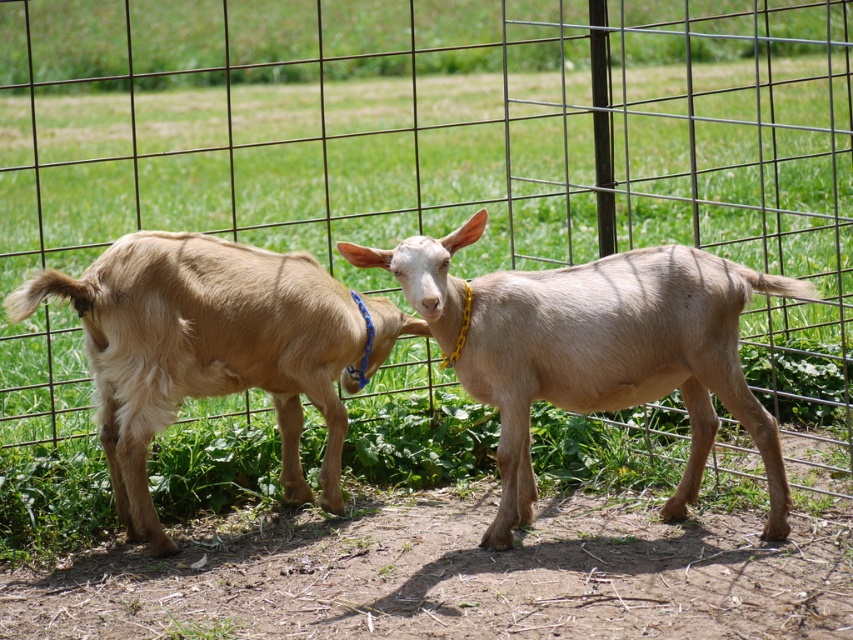
Question: Does light brown fur goat at center appear over light brown fur goat at left?

Choices:
 (A) yes
 (B) no

Answer: (A)

Question: Does light brown fur goat at center appear on the right side of light brown fur goat at left?

Choices:
 (A) no
 (B) yes

Answer: (B)

Question: Which object is closer to the camera taking this photo?

Choices:
 (A) light brown fur goat at left
 (B) light brown fur goat at center

Answer: (B)

Question: Which point is closer to the camera taking this photo?

Choices:
 (A) (537, 372)
 (B) (183, 342)

Answer: (A)

Question: Does light brown fur goat at center appear under light brown fur goat at left?

Choices:
 (A) yes
 (B) no

Answer: (B)